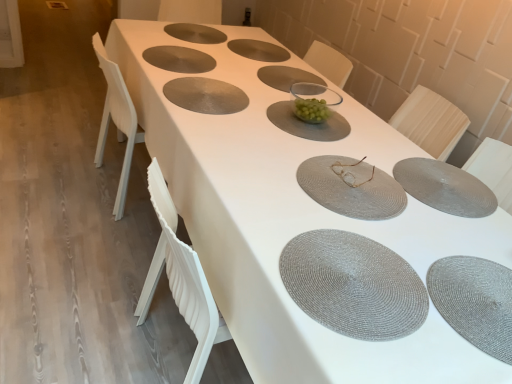
The width and height of the screenshot is (512, 384). Find the location of `free space underneath gray woven placemat at center (from a real-world perspective)`. free space underneath gray woven placemat at center (from a real-world perspective) is located at coordinates (203, 89).